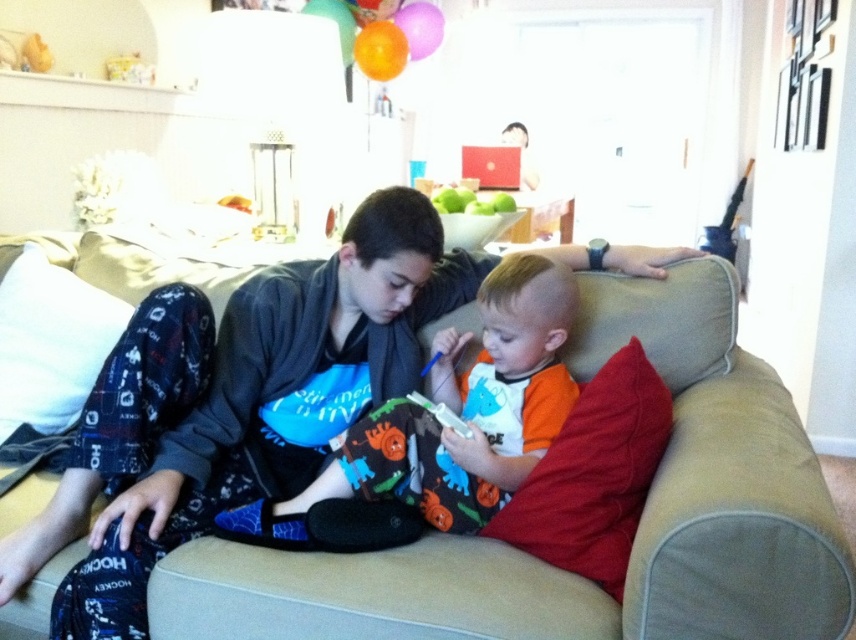
You are standing in the living room and see two points marked in the image. Which point, point (x=684, y=536) or point (x=331, y=547), is closer to you?

Point (x=684, y=536) is closer to the viewer than point (x=331, y=547).

You are a furniture designer trying to place a new chair in this living room. The chair you want to place is the same size as the orange cotton shirt at center. Can you fit the chair on the beige fabric couch at center without overlapping?

The beige fabric couch at center has a larger size compared to orange cotton shirt at center. Therefore, the chair can be placed on the beige fabric couch at center without overlapping since it is larger than the shirt.

You are a delivery robot standing 1 meter away from the beige fabric couch at center. Can you place a small package on the couch without moving closer than 90 centimeters?

The beige fabric couch at center is 95.27 centimeters away from the viewer. Since the robot is standing 1 meter away, which is 100 centimeters, it is 4.73 centimeters farther than the required 90 centimeters. Therefore, the robot can place the package on the couch without moving closer than 90 centimeters.